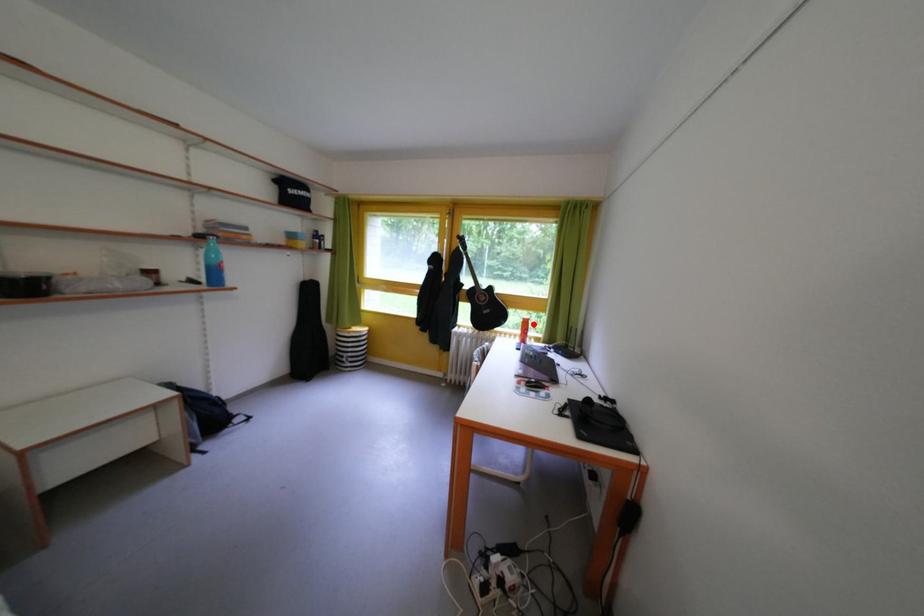
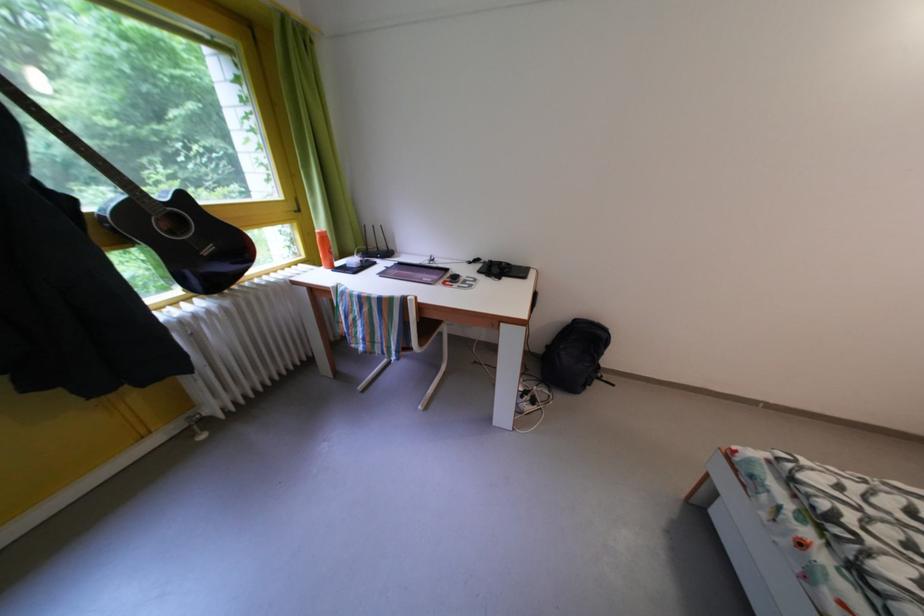
Locate, in the second image, the point that corresponds to the highlighted location in the first image.

(329, 238)